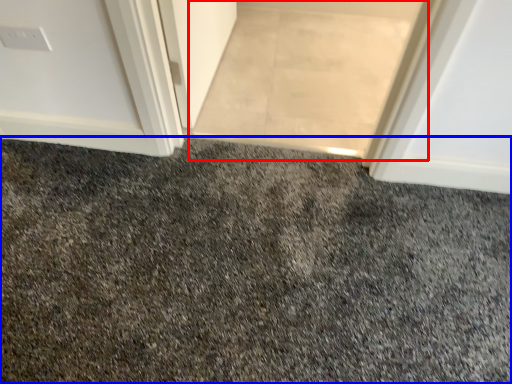
Question: Which object appears farthest to the camera in this image, doormat (highlighted by a red box) or granite (highlighted by a blue box)?

Choices:
 (A) doormat
 (B) granite

Answer: (A)